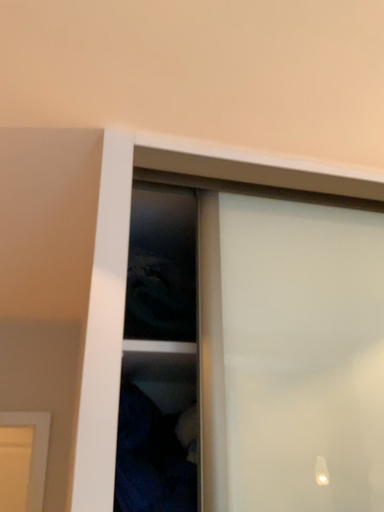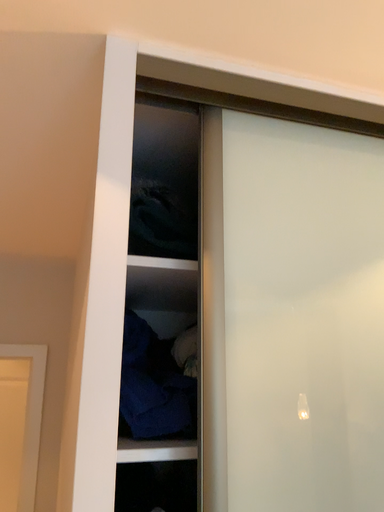
Question: How did the camera likely rotate when shooting the video?

Choices:
 (A) rotated upward
 (B) rotated downward

Answer: (B)